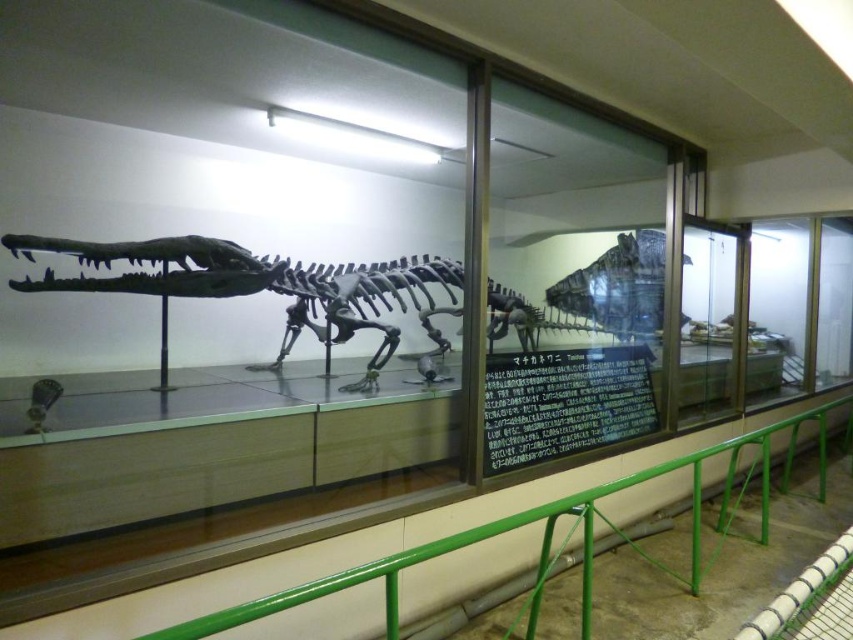
You are standing in front of the museum exhibit and want to read the black matte signboard at center. Where should you look to find it?

The black matte signboard at center is located at the coordinates point [564,403], so you should look towards that point to find it.

Consider the image. You are a visitor standing in front of the museum exhibit. You notice two points marked on the glass case at coordinates point (x=613, y=492) and point (x=614, y=248). Which of these points is closer to you?

Point (x=613, y=492) is in front of point (x=614, y=248), so it is closer to you.

You are a visitor standing in front of the museum exhibit. You want to take a photo of the dinosaur skeleton without any obstructions. Is the green metal railing at lower center blocking your view? Please explain based on its position.

The green metal railing at lower center is located at point (506, 531), which is at the lower center of the image. Since the railing is at the lower part of the display, it likely does not obstruct the view of the dinosaur skeleton above it. You should be able to take a clear photo without the railing blocking the skeleton.